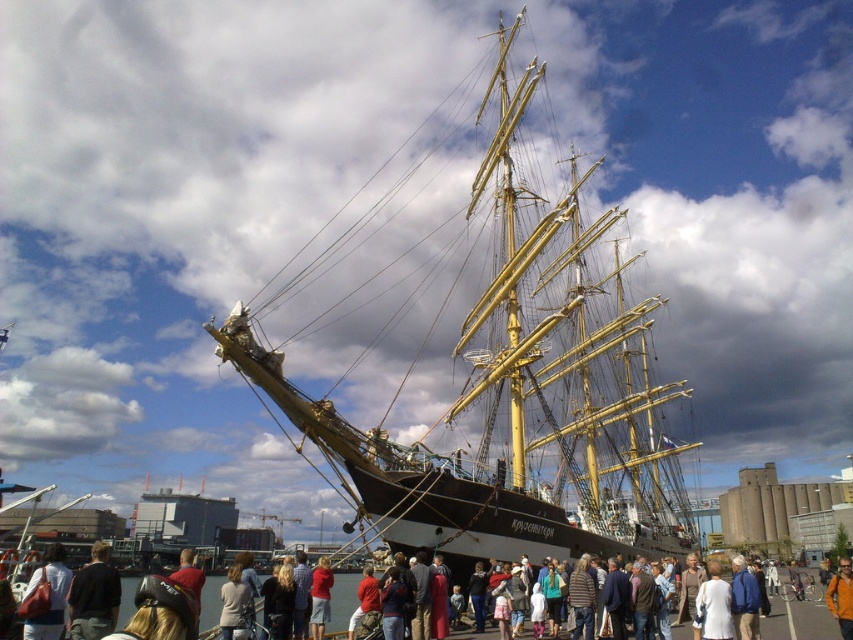
You are standing at the center of the image and want to find the dark brown leather jacket at lower left. In which direction should you look?

You should look to the lower left direction to find the dark brown leather jacket at lower left.

You are standing at the point marked as point (25, 605) and want to take a photo of the ship. The camera you are using has a maximum zoom range of 200 feet. Will you be able to capture the ship clearly without moving closer?

The distance between point (25, 605) and the camera is 258.48 feet. Since the camera has a maximum zoom range of 200 feet, you will not be able to capture the ship clearly without moving closer.